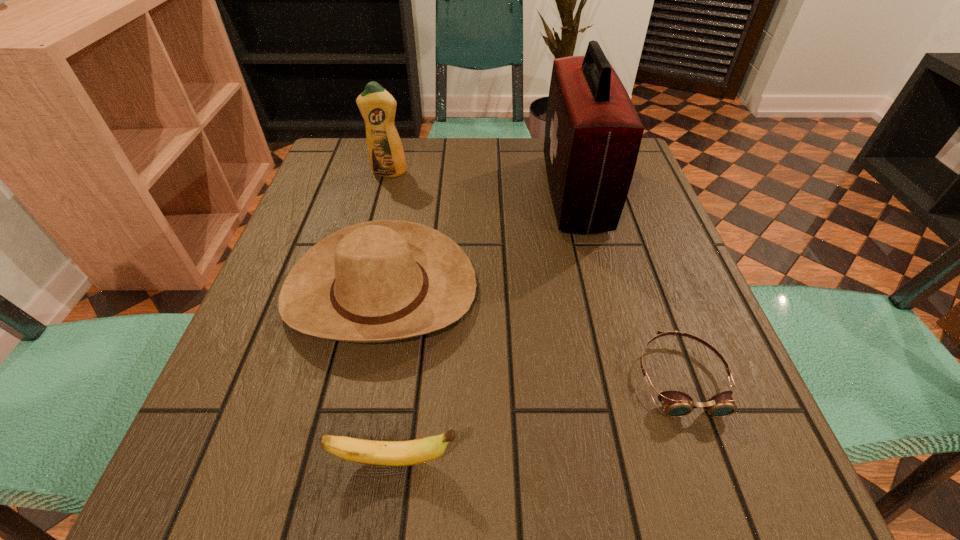
This screenshot has width=960, height=540. I want to click on the first aid kit, so click(x=593, y=133).

You are a GUI agent. You are given a task and a screenshot of the screen. Output one action in this format:
    pyautogui.click(x=<x>, y=<y>)
    Task: Click on the detergent
    The height and width of the screenshot is (540, 960).
    Given the screenshot: What is the action you would take?
    pyautogui.click(x=377, y=106)

Image resolution: width=960 pixels, height=540 pixels. What are the coordinates of `the third shortest object` in the screenshot? It's located at click(378, 281).

Where is `the second shortest object`? the second shortest object is located at coordinates (412, 452).

This screenshot has width=960, height=540. Identify the location of banana. (412, 452).

You are a GUI agent. You are given a task and a screenshot of the screen. Output one action in this format:
    pyautogui.click(x=<x>, y=<y>)
    Task: Click on the shortest object
    The image size is (960, 540).
    Given the screenshot: What is the action you would take?
    pyautogui.click(x=676, y=404)

The width and height of the screenshot is (960, 540). Identify the location of free space located 0.140m on the side of the tallest object with the cross symbol. (490, 192).

The width and height of the screenshot is (960, 540). In order to click on vacant space located 0.140m on the side of the tallest object with the cross symbol in this screenshot , I will do coord(490,192).

The height and width of the screenshot is (540, 960). In order to click on blank area located 0.060m on the side of the tallest object with the cross symbol in this screenshot , I will do `click(522, 192)`.

At what (x,y) coordinates should I click in order to perform the action: click on vacant space located 0.310m on the label of the detergent. Please return your answer as a coordinate pair (x, y). Looking at the image, I should click on (365, 263).